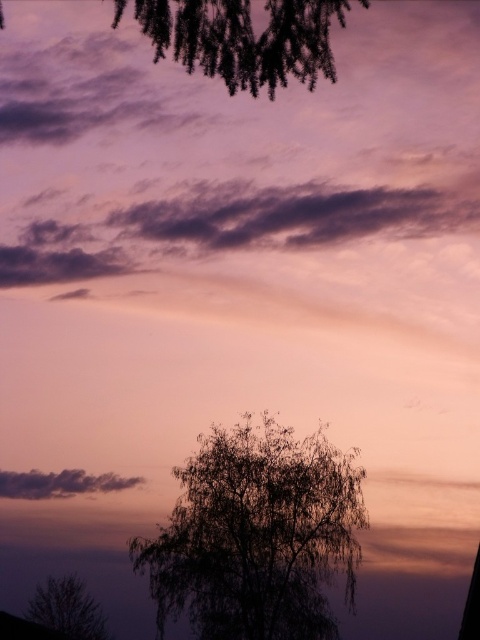
From the picture: You are an astronomer observing the sunset scene. You notice a point marked at coordinates (256, 536) in the image. Based on the scene description, what significant feature does this point likely indicate?

The point at (256, 536) marks silvery branches at center, which are part of the tree silhouette in the foreground.

You are standing in the sunset scene and notice two points marked in the image. The first point is at coordinate point (235,483) and the second point is at coordinate point (404,195). Which point is closer to you?

Point (235,483) is in front of point (404,195), so it is closer to you.

You are standing at the edge of a field looking at the sunset scene. You want to estimate how far the dark purple cloud at upper center is from you. What is the approximate distance?

The dark purple cloud at upper center is approximately 96.61 feet away from the viewer.